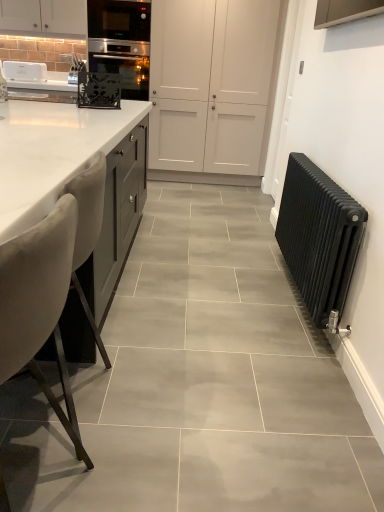
Question: Would you say black cast iron radiator at right is inside or outside velvet beige chair at left?

Choices:
 (A) inside
 (B) outside

Answer: (B)

Question: From the image's perspective, is black cast iron radiator at right positioned above or below velvet beige chair at left?

Choices:
 (A) below
 (B) above

Answer: (B)

Question: Estimate the real-world distances between objects in this image. Which object is closer to the black cast iron radiator at right?

Choices:
 (A) white matte cabinet at upper center
 (B) velvet beige chair at left
 (C) white marble countertop at left

Answer: (C)

Question: Considering the real-world distances, which object is farthest from the white matte cabinet at upper center?

Choices:
 (A) black cast iron radiator at right
 (B) velvet beige chair at left
 (C) white marble countertop at left

Answer: (B)